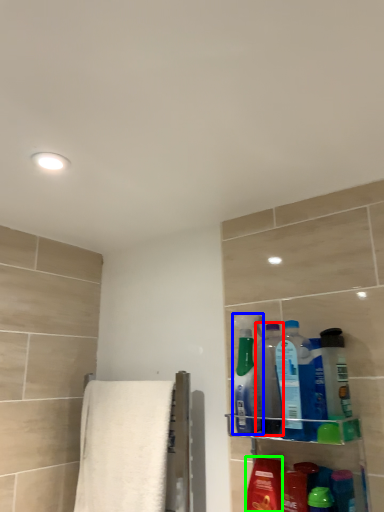
Question: Estimate the real-world distances between objects in this image. Which object is closer to cleaning product (highlighted by a red box), cleaning product (highlighted by a blue box) or mouthwash (highlighted by a green box)?

Choices:
 (A) cleaning product
 (B) mouthwash

Answer: (A)